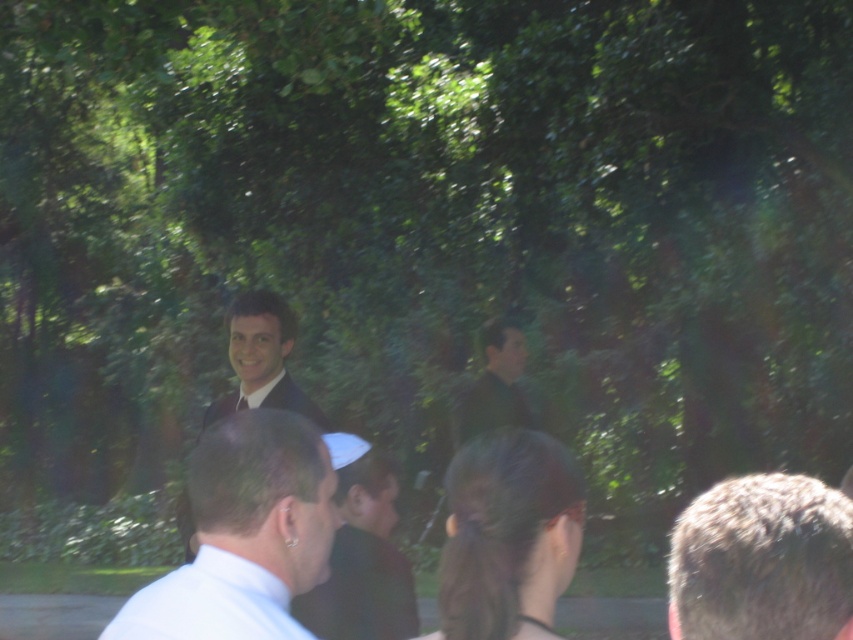
Looking at this image, can you confirm if blonde hair at right is positioned to the left of dark green fabric shirt at center?

In fact, blonde hair at right is to the right of dark green fabric shirt at center.

Measure the distance between blonde hair at right and camera.

They are 1.70 meters apart.

I want to click on blonde hair at right, so click(x=762, y=561).

Between white matte shirt at center and blonde hair at right, which one is positioned higher?

white matte shirt at center

Is white matte shirt at center smaller than blonde hair at right?

Yes.

Between point (281, 604) and point (689, 512), which one is positioned behind?

Point (689, 512)

The height and width of the screenshot is (640, 853). I want to click on white matte shirt at center, so click(x=247, y=532).

Is white matte shirt at center shorter than shiny black suit at center?

Yes, white matte shirt at center is shorter than shiny black suit at center.

Does white matte shirt at center appear under shiny black suit at center?

Yes.

Measure the distance between point (198,540) and camera.

They are 9.83 feet apart.

Locate an element on the screen. The height and width of the screenshot is (640, 853). white matte shirt at center is located at coordinates (247, 532).